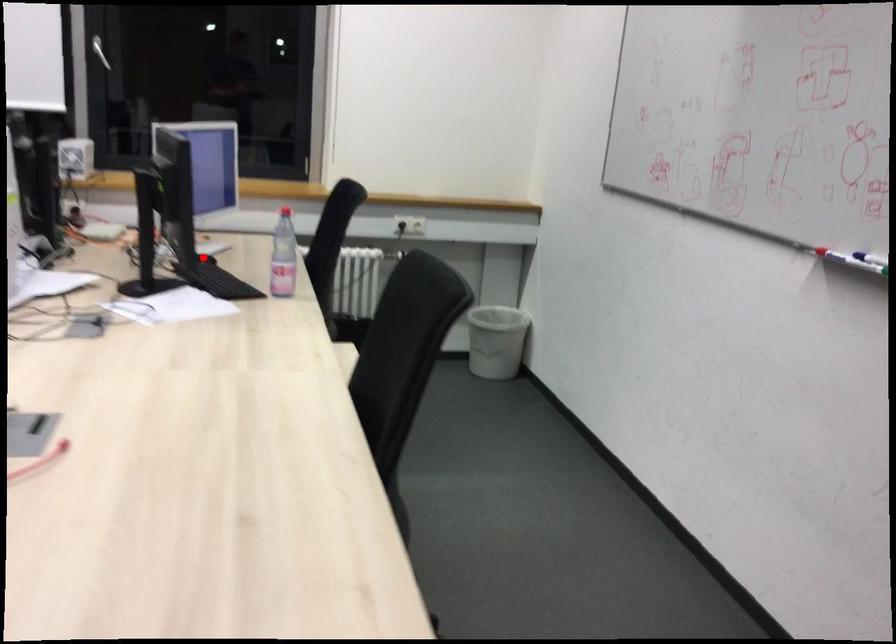
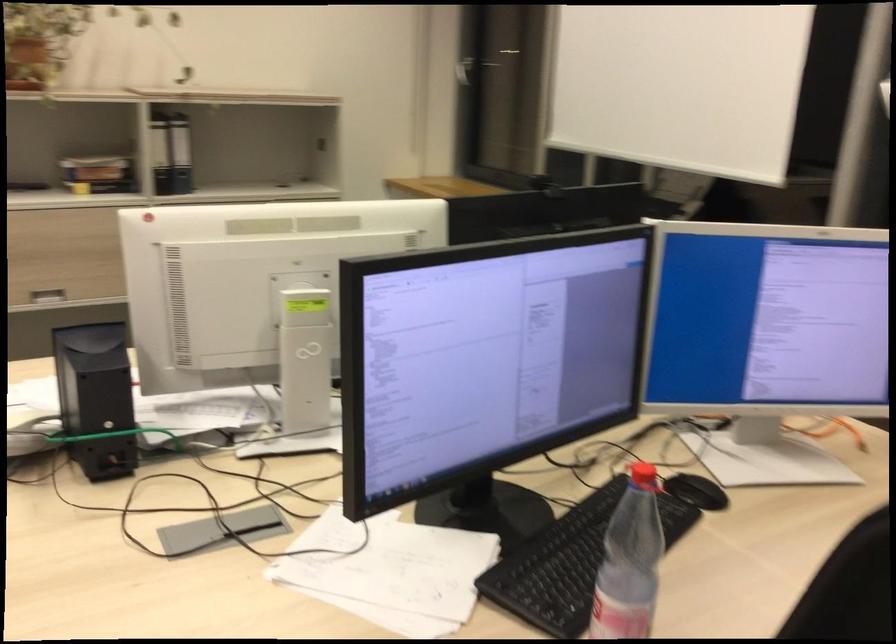
Question: I am providing you with two images of the same scene from different viewpoints. In image1, a red point is highlighted. Considering the same 3D point in image2, which of the following is correct?

Choices:
 (A) It is closer
 (B) It is farther

Answer: (A)